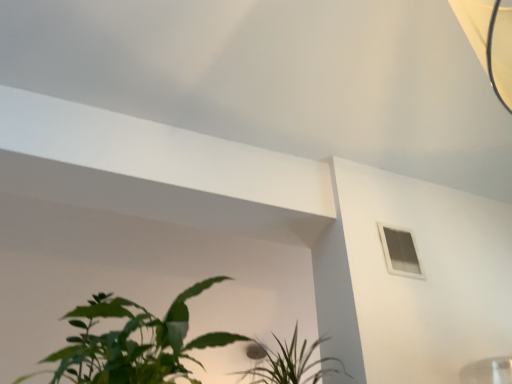
What do you see at coordinates (289, 363) in the screenshot?
I see `green leafy plant at lower center` at bounding box center [289, 363].

Find the location of a particular element. This screenshot has height=384, width=512. green leafy plant at lower center is located at coordinates (289, 363).

In order to face white plastic window at upper right, should I rotate leftwards or rightwards?

It's best to rotate right around 19.142 degrees.

This screenshot has height=384, width=512. What are the coordinates of `white plastic window at upper right` in the screenshot? It's located at (400, 252).

What do you see at coordinates (400, 252) in the screenshot? I see `white plastic window at upper right` at bounding box center [400, 252].

What is the approximate width of white plastic window at upper right?

It is 1.17 inches.

The image size is (512, 384). Identify the location of green leafy plant at lower center. (289, 363).

Does white plastic window at upper right appear on the right side of green leafy plant at lower center?

Indeed, white plastic window at upper right is positioned on the right side of green leafy plant at lower center.

Relative to green leafy plant at lower center, is white plastic window at upper right in front or behind?

white plastic window at upper right is behind green leafy plant at lower center.

Is point (425, 278) in front of point (267, 351)?

That is True.

From the image's perspective, does white plastic window at upper right appear higher than green leafy plant at lower center?

Indeed, from the image's perspective, white plastic window at upper right is shown above green leafy plant at lower center.

From a real-world perspective, is white plastic window at upper right positioned under green leafy plant at lower center based on gravity?

Incorrect, from a real-world perspective, white plastic window at upper right is higher than green leafy plant at lower center.

Considering the sizes of white plastic window at upper right and green leafy plant at lower center in the image, is white plastic window at upper right wider or thinner than green leafy plant at lower center?

Considering their sizes, white plastic window at upper right looks slimmer than green leafy plant at lower center.

Between white plastic window at upper right and green leafy plant at lower center, which one has less height?

green leafy plant at lower center is shorter.

Who is bigger, white plastic window at upper right or green leafy plant at lower center?

green leafy plant at lower center.

Could green leafy plant at lower center be considered to be inside white plastic window at upper right?

That's incorrect, green leafy plant at lower center is not inside white plastic window at upper right.

Is white plastic window at upper right far from green leafy plant at lower center?

No, there isn't a large distance between white plastic window at upper right and green leafy plant at lower center.

Is white plastic window at upper right oriented towards green leafy plant at lower center?

No, white plastic window at upper right is not oriented towards green leafy plant at lower center.

The width and height of the screenshot is (512, 384). Identify the location of houseplant in front of the white plastic window at upper right. (289, 363).

Can you confirm if green leafy plant at lower center is positioned to the right of white plastic window at upper right?

No.

Which object is more forward, green leafy plant at lower center or white plastic window at upper right?

Positioned in front is green leafy plant at lower center.

Is point (284, 364) farther from camera compared to point (403, 237)?

That is True.

Based on the photo, from the image's perspective, is green leafy plant at lower center positioned above or below white plastic window at upper right?

Based on their image positions, green leafy plant at lower center is located beneath white plastic window at upper right.

From a real-world perspective, is green leafy plant at lower center on white plastic window at upper right?

No, from a real-world perspective, green leafy plant at lower center is not above white plastic window at upper right.

In terms of width, does green leafy plant at lower center look wider or thinner when compared to white plastic window at upper right?

Clearly, green leafy plant at lower center has more width compared to white plastic window at upper right.

Can you confirm if green leafy plant at lower center is taller than white plastic window at upper right?

No, green leafy plant at lower center is not taller than white plastic window at upper right.

From the picture: Is green leafy plant at lower center bigger than white plastic window at upper right?

Yes.

Consider the image. Would you say green leafy plant at lower center is outside white plastic window at upper right?

Yes.

Would you consider green leafy plant at lower center to be distant from white plastic window at upper right?

Actually, green leafy plant at lower center and white plastic window at upper right are a little close together.

Could you tell me if green leafy plant at lower center is turned towards white plastic window at upper right?

No, green leafy plant at lower center does not turn towards white plastic window at upper right.

How different are the orientations of green leafy plant at lower center and white plastic window at upper right in degrees?

green leafy plant at lower center and white plastic window at upper right are facing 177 degrees away from each other.

The height and width of the screenshot is (384, 512). I want to click on houseplant in front of the white plastic window at upper right, so tap(289, 363).

Where is `window located above the green leafy plant at lower center (from a real-world perspective)`? Image resolution: width=512 pixels, height=384 pixels. window located above the green leafy plant at lower center (from a real-world perspective) is located at coordinates (400, 252).

The image size is (512, 384). Identify the location of window behind the green leafy plant at lower center. (400, 252).